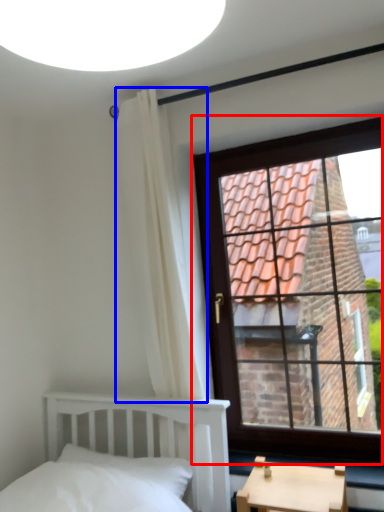
Question: Which point is closer to the camera, window (highlighted by a red box) or curtain (highlighted by a blue box)?

Choices:
 (A) window
 (B) curtain

Answer: (B)